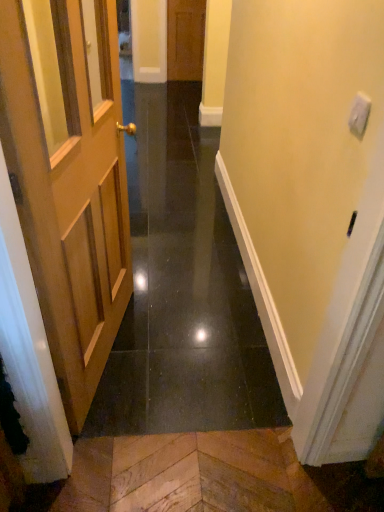
Identify the location of spots to the right of light brown wooden door at left, which ranks as the 2th door in back-to-front order. (193, 352).